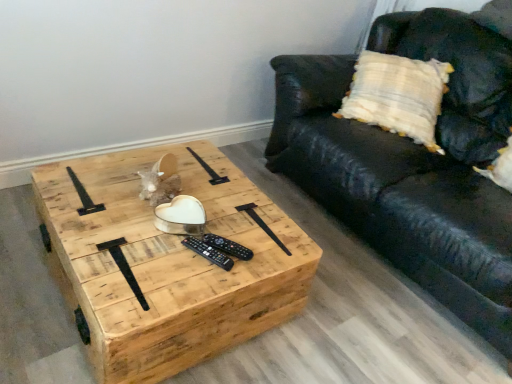
At what (x,y) coordinates should I click in order to perform the action: click on free space in front of black plastic remote at center, the 1th remote viewed from the front. Please return your answer as a coordinate pair (x, y). The image size is (512, 384). Looking at the image, I should click on click(x=179, y=287).